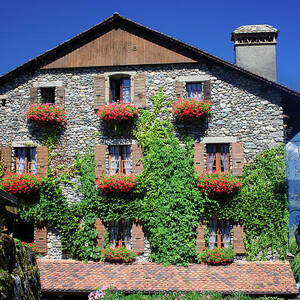
At what (x,y) coordinates should I click in order to perform the action: click on glass. Please return your answer as a coordinate pair (x, y). Looking at the image, I should click on (225, 150).